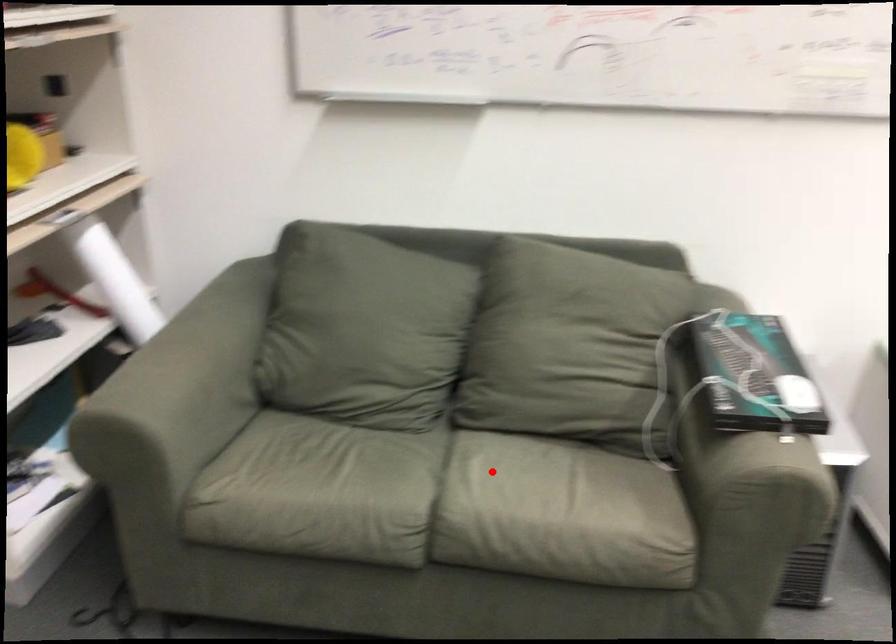
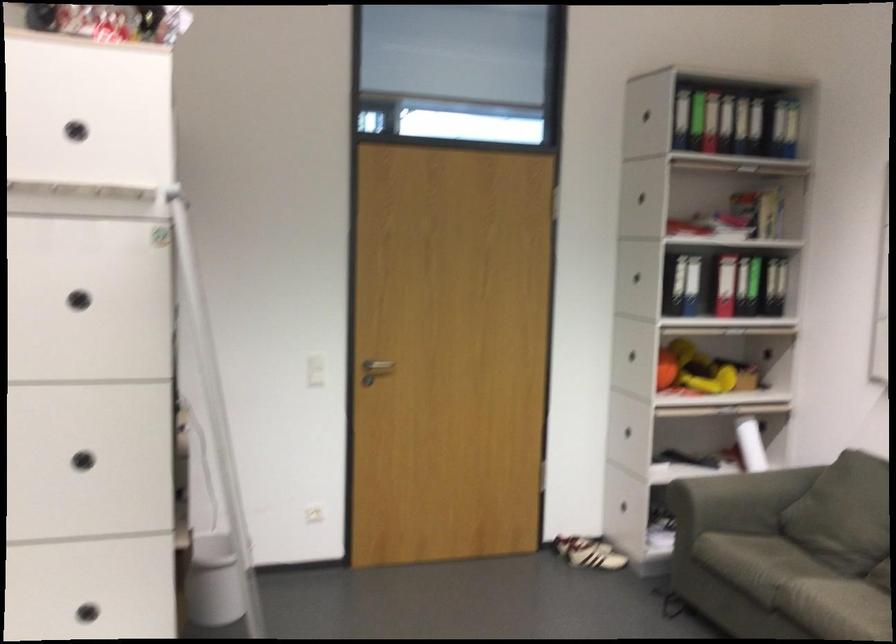
Where in the second image is the point corresponding to the highlighted location from the first image?

(832, 592)